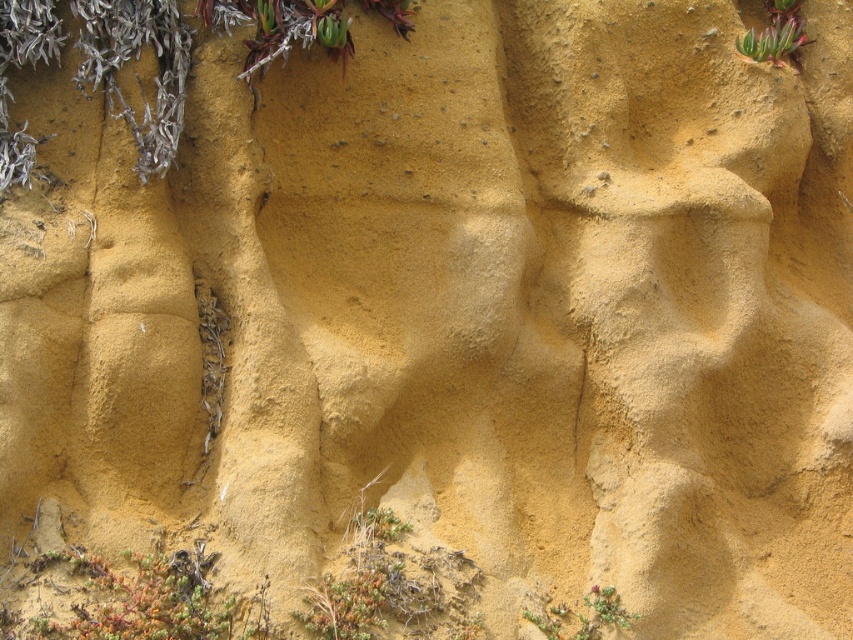
Does green succulent at lower right appear on the left side of green succulent at upper right?

Indeed, green succulent at lower right is positioned on the left side of green succulent at upper right.

Is green succulent at lower right bigger than green succulent at upper right?

No.

I want to click on green succulent at lower right, so click(x=583, y=616).

Which is more to the left, green succulent at lower left or green succulent at lower right?

green succulent at lower left is more to the left.

Can you confirm if green succulent at lower left is positioned above green succulent at lower right?

Yes, green succulent at lower left is above green succulent at lower right.

Describe the element at coordinates (148, 600) in the screenshot. I see `green succulent at lower left` at that location.

This screenshot has height=640, width=853. I want to click on green succulent at lower left, so click(148, 600).

Between point (177, 564) and point (735, 49), which one is positioned in front?

Positioned in front is point (177, 564).

Is green succulent at lower left shorter than green succulent at upper right?

Indeed, green succulent at lower left has a lesser height compared to green succulent at upper right.

Is point (225, 605) more distant than point (776, 10)?

No, (225, 605) is in front of (776, 10).

Locate an element on the screen. The image size is (853, 640). green succulent at lower left is located at coordinates (148, 600).